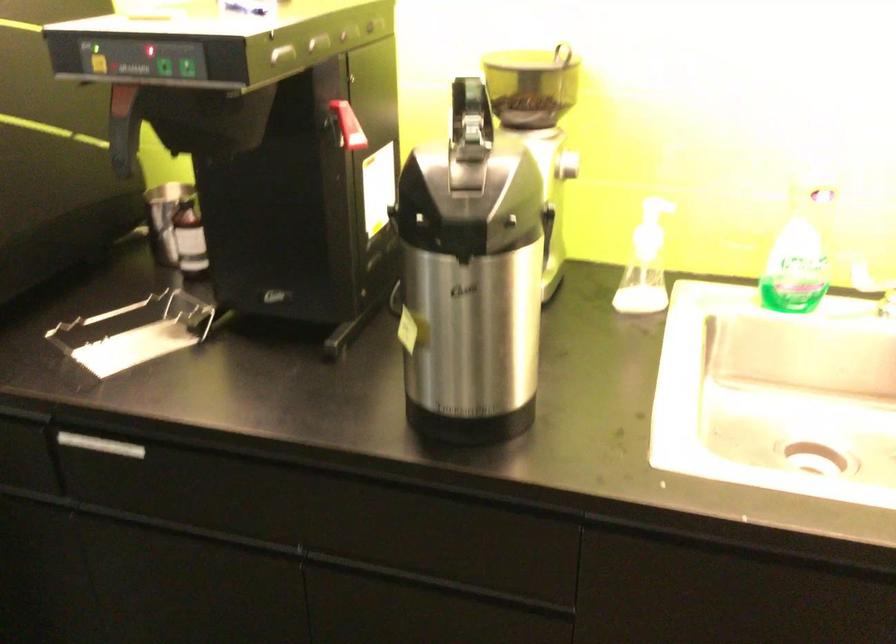
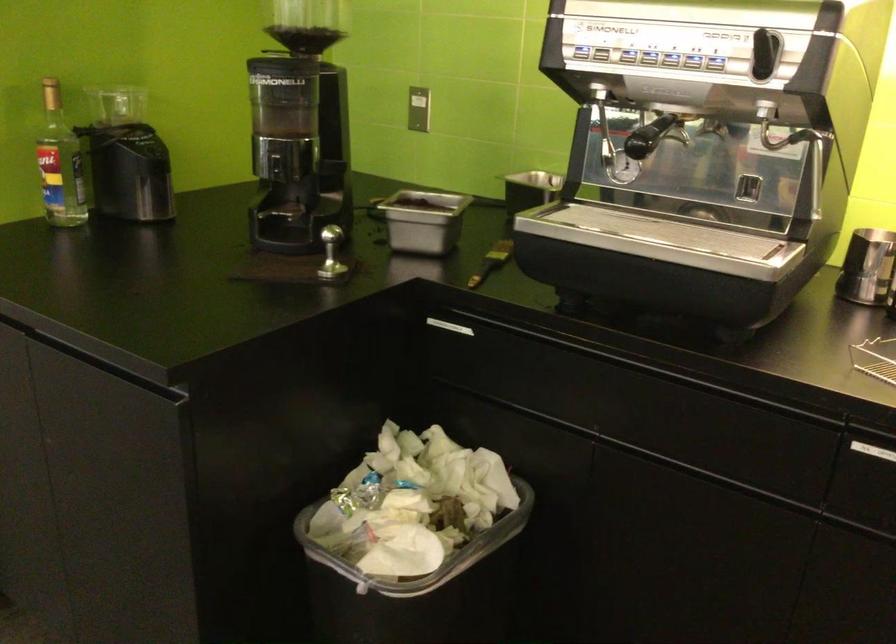
Question: In a continuous first-person perspective shot, in which direction is the camera moving?

Choices:
 (A) Left
 (B) Right
 (C) Forward
 (D) Backward

Answer: (A)